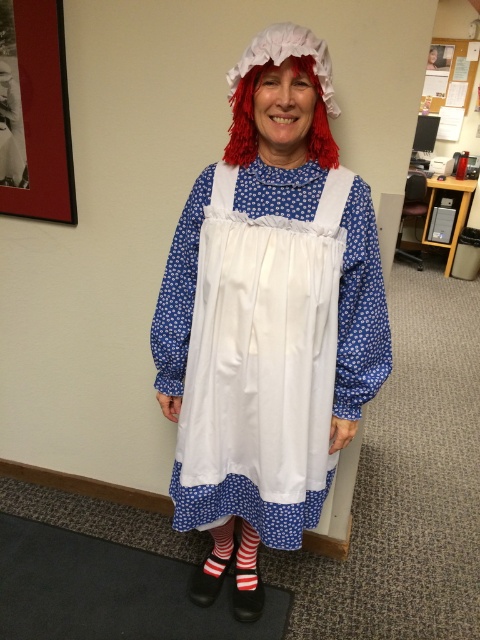
Question: Can you confirm if white cotton dress at center is bigger than red fluffy wig at center?

Choices:
 (A) yes
 (B) no

Answer: (A)

Question: Is white cotton dress at center below red fluffy wig at center?

Choices:
 (A) no
 (B) yes

Answer: (B)

Question: Among these objects, which one is farthest from the camera?

Choices:
 (A) white cotton dress at center
 (B) red fluffy wig at center

Answer: (B)

Question: Which object is closer to the camera taking this photo?

Choices:
 (A) red fluffy wig at center
 (B) white cotton dress at center

Answer: (B)

Question: Which point appears farthest from the camera in this image?

Choices:
 (A) (245, 129)
 (B) (288, 378)

Answer: (B)

Question: In this image, where is white cotton dress at center located relative to red fluffy wig at center?

Choices:
 (A) below
 (B) above

Answer: (A)